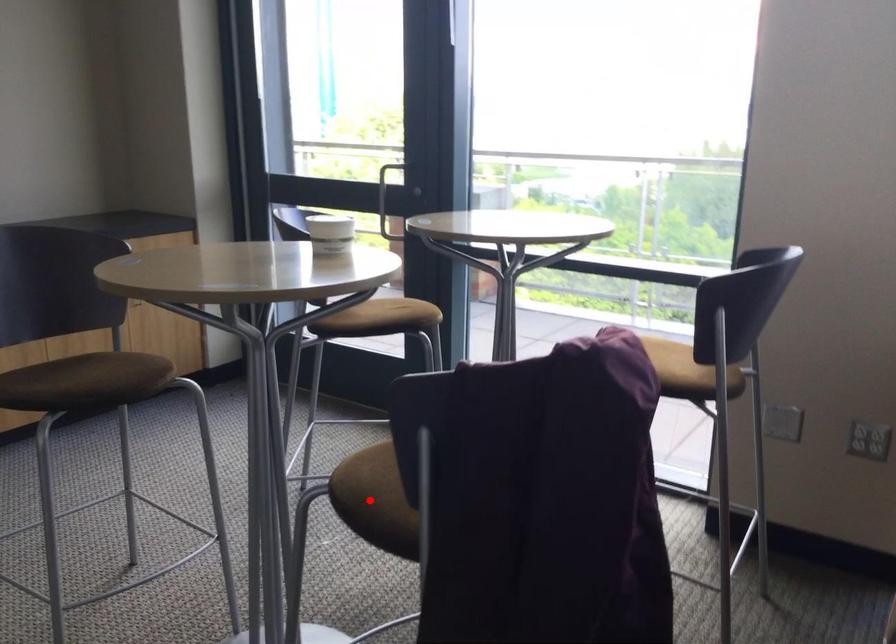
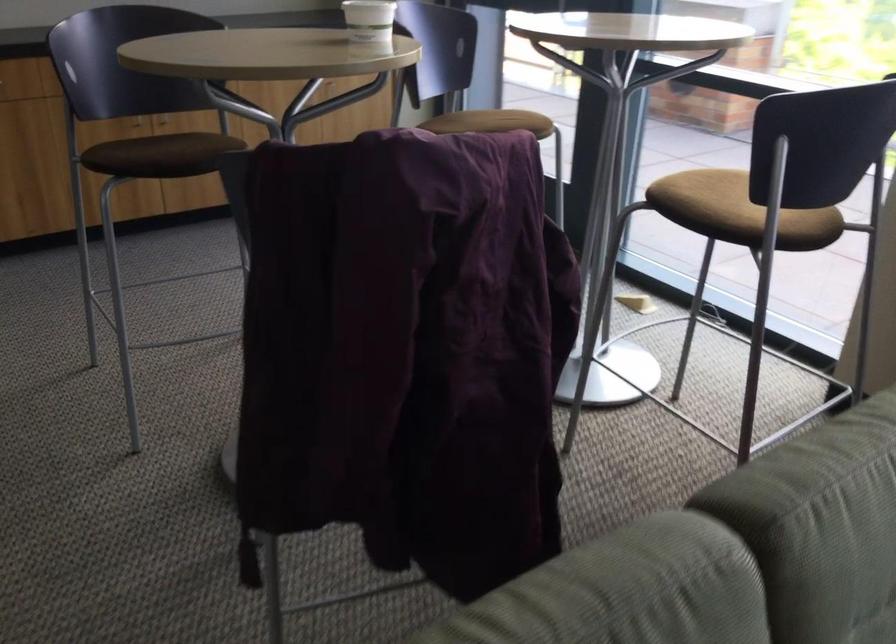
Question: I am providing you with two images of the same scene from different viewpoints. A red point is marked on the first image. At the location where the point appears in image 1, is it still visible in image 2?

Choices:
 (A) Yes
 (B) No

Answer: (B)